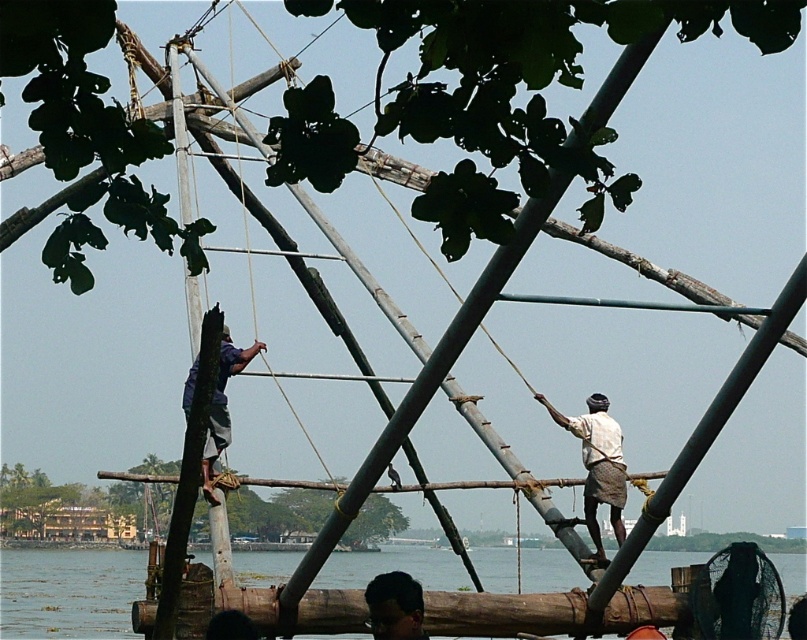
Question: Which object appears closest to the camera in this image?

Choices:
 (A) clear water at lower left
 (B) dark brown hair at lower center

Answer: (B)

Question: Does clear water at lower left have a greater width compared to dark brown hair at lower center?

Choices:
 (A) no
 (B) yes

Answer: (B)

Question: Which object is the closest to the white cotton shirt at right?

Choices:
 (A) dark brown hair at lower center
 (B) blue fabric shirt at upper center
 (C) clear water at lower left

Answer: (A)

Question: Does clear water at lower left come behind dark brown hair at lower center?

Choices:
 (A) yes
 (B) no

Answer: (A)

Question: Is clear water at lower left bigger than blue fabric shirt at upper center?

Choices:
 (A) no
 (B) yes

Answer: (B)

Question: Which point is farther to the camera?

Choices:
 (A) blue fabric shirt at upper center
 (B) white cotton shirt at right

Answer: (B)